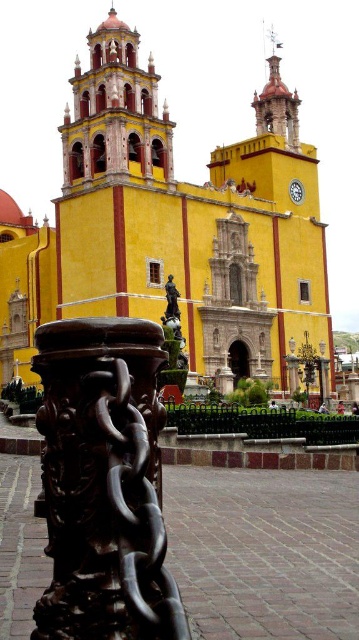
You are standing in front of the church and want to take a photo of the polished dark brown pillar at center and the matte yellow tower at upper left. Which object should you aim your camera at first to ensure both are in frame?

You should aim your camera at the polished dark brown pillar at center first because it is located below the matte yellow tower at upper left, so adjusting the camera upwards will include both in the frame.

You are a tourist standing in front of the yellow stone church at center and the matte yellow tower at upper left. Which structure would appear larger to you when looking at them from your current position?

The yellow stone church at center is much taller than the matte yellow tower at upper left, so it would appear larger when viewed from your current position.

You are standing in front of the yellow stone church at center and the polished dark brown pillar at center. Which object is positioned to the left when facing the church?

The polished dark brown pillar at center is positioned to the left of the yellow stone church at center when facing the church.